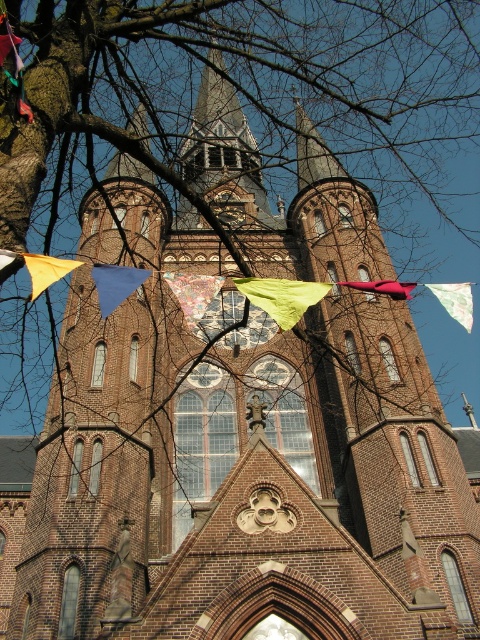
Consider the image. You are a visitor standing in front of the grand historic church. You notice two flags flying at the center of the building. Which flag has a narrower width between the blue fabric flag at center and the yellow fabric flag at center?

The blue fabric flag at center has a lesser width compared to the yellow fabric flag at center, so the blue fabric flag at center is narrower.